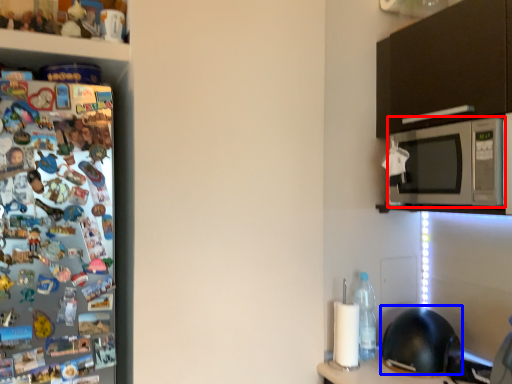
Question: Which object is further to the camera taking this photo, microwave oven (highlighted by a red box) or helmet (highlighted by a blue box)?

Choices:
 (A) microwave oven
 (B) helmet

Answer: (B)